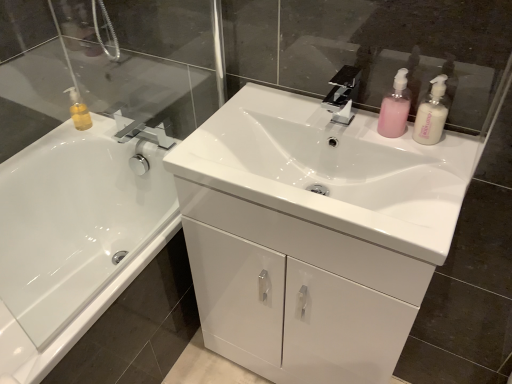
Find the location of a particular element. The image size is (512, 384). free space in front of black glossy faucet at center is located at coordinates (367, 147).